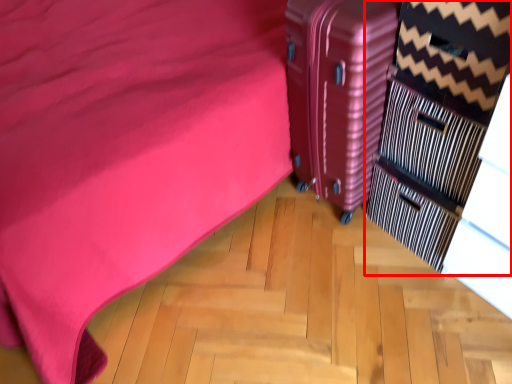
Question: From the image, what is the correct spatial relationship of dresser (annotated by the red box) in relation to suitcase?

Choices:
 (A) right
 (B) left

Answer: (A)